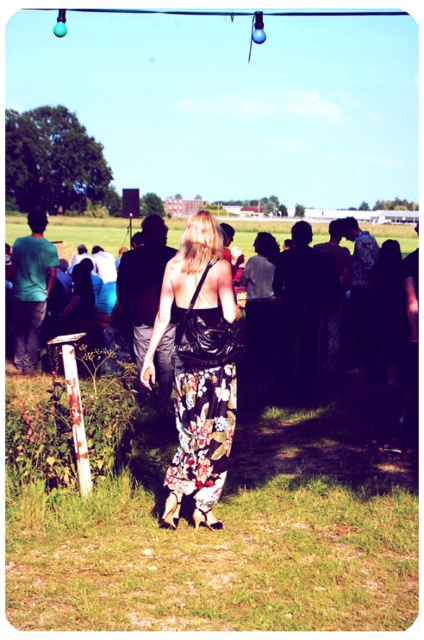
You are standing in the grassy field and want to walk from point A to point B. Point A is located at coordinate point(374, 314) and point B is at coordinate point(176, 506). Which point is closer to you?

Point A at coordinate point(374, 314) is closer to you than point B at coordinate point(176, 506) because it is further to the viewer.

A woman is wearing a floral fabric dress at center. She wants to throw a small ball to her friend who is standing 7.66 meters away. If the dress has a long train that might get in the way, would she need to adjust her throwing position to avoid it?

The woman wearing the floral fabric dress at center is 7.66 meters away from her friend. Since the dress has a long train, she should adjust her throwing position by stepping forward or sideways to avoid the train interfering with the throw.